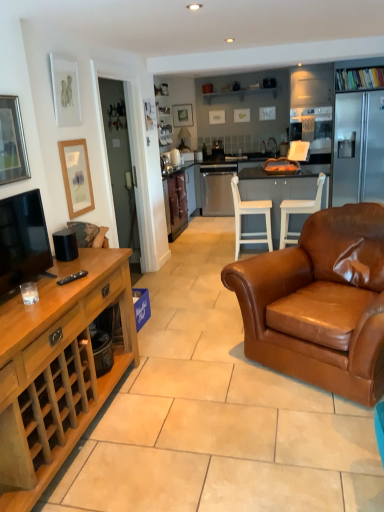
I want to click on free space that is to the left of brown leather armchair at center, so click(x=202, y=359).